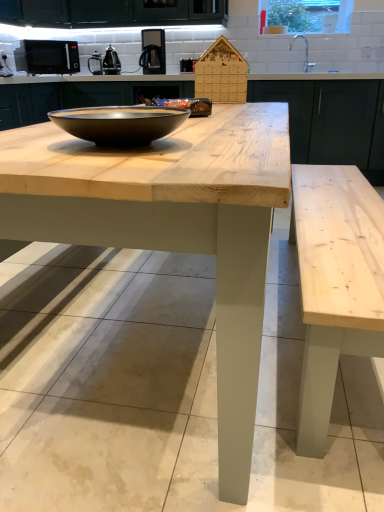
Consider the image. Measure the distance between point (x=114, y=61) and camera.

4.10 meters.

This screenshot has height=512, width=384. What are the coordinates of `natural wood cabinetry at center` in the screenshot? It's located at (331, 120).

Describe the element at coordinates (47, 57) in the screenshot. I see `black matte microwave at upper left, the second appliance in the right-to-left sequence` at that location.

Where is `black matte microwave at upper left, placed as the 1th appliance when sorted from left to right`? black matte microwave at upper left, placed as the 1th appliance when sorted from left to right is located at coordinates (47, 57).

The height and width of the screenshot is (512, 384). What do you see at coordinates (153, 52) in the screenshot? I see `satin black coffee machine at upper center` at bounding box center [153, 52].

I want to click on metallic silver kettle at upper center, placed as the 2th appliance when sorted from left to right, so click(105, 63).

Consider the image. Can you confirm if matte black bowl at center is smaller than natural wood cabinetry at center?

Correct, matte black bowl at center occupies less space than natural wood cabinetry at center.

Does point (124, 117) come farther from viewer compared to point (340, 156)?

No, (124, 117) is in front of (340, 156).

Is matte black bowl at center wider than natural wood cabinetry at center?

No, matte black bowl at center is not wider than natural wood cabinetry at center.

Does matte black bowl at center have a lesser height compared to natural wood cabinetry at center?

Yes, matte black bowl at center is shorter than natural wood cabinetry at center.

Considering the positions of objects black matte microwave at upper left, the second appliance in the right-to-left sequence, and matte black bowl at center in the image provided, who is behind, black matte microwave at upper left, the second appliance in the right-to-left sequence, or matte black bowl at center?

black matte microwave at upper left, the second appliance in the right-to-left sequence, is further from the camera.

Can you confirm if black matte microwave at upper left, placed as the 1th appliance when sorted from left to right, is taller than matte black bowl at center?

Yes, black matte microwave at upper left, placed as the 1th appliance when sorted from left to right, is taller than matte black bowl at center.

Can you tell me how much black matte microwave at upper left, placed as the 1th appliance when sorted from left to right, and matte black bowl at center differ in facing direction?

They differ by 133 degrees in their facing directions.

Considering the relative sizes of satin black coffee machine at upper center and matte black bowl at center in the image provided, is satin black coffee machine at upper center wider than matte black bowl at center?

No, satin black coffee machine at upper center is not wider than matte black bowl at center.

Is point (159, 66) farther from viewer compared to point (169, 106)?

Yes, it is behind point (169, 106).

Is matte black bowl at center a part of satin black coffee machine at upper center?

No.

Is satin black coffee machine at upper center shorter than matte black bowl at center?

In fact, satin black coffee machine at upper center may be taller than matte black bowl at center.

Between black matte microwave at upper left, placed as the 1th appliance when sorted from left to right, and natural wood table at center, which one has smaller width?

black matte microwave at upper left, placed as the 1th appliance when sorted from left to right, is thinner.

Does black matte microwave at upper left, the second appliance in the right-to-left sequence, contain natural wood table at center?

No.

Considering the relative sizes of black matte microwave at upper left, the second appliance in the right-to-left sequence, and natural wood table at center in the image provided, is black matte microwave at upper left, the second appliance in the right-to-left sequence, bigger than natural wood table at center?

Actually, black matte microwave at upper left, the second appliance in the right-to-left sequence, might be smaller than natural wood table at center.

Between black matte microwave at upper left, placed as the 1th appliance when sorted from left to right, and natural wood table at center, which one has more height?

Answer: Standing taller between the two is natural wood table at center.

Considering the sizes of natural wood table at center and matte black bowl at center in the image, is natural wood table at center bigger or smaller than matte black bowl at center?

Considering their sizes, natural wood table at center takes up more space than matte black bowl at center.

Is matte black bowl at center located within natural wood table at center?

That's incorrect, matte black bowl at center is not inside natural wood table at center.

Is point (27, 154) farther from viewer compared to point (169, 124)?

No, (27, 154) is closer to viewer.

Consider the image. Considering the sizes of objects natural wood table at center and matte black bowl at center in the image provided, who is wider, natural wood table at center or matte black bowl at center?

natural wood table at center.

Looking at this image, from the image's perspective, relative to metallic silver kettle at upper center, positioned as the 1th appliance in right-to-left order, is matte black bowl at center above or below?

matte black bowl at center is situated lower than metallic silver kettle at upper center, positioned as the 1th appliance in right-to-left order, in the image.

Can you confirm if matte black bowl at center is bigger than metallic silver kettle at upper center, positioned as the 1th appliance in right-to-left order?

Incorrect, matte black bowl at center is not larger than metallic silver kettle at upper center, positioned as the 1th appliance in right-to-left order.

Can you see matte black bowl at center touching metallic silver kettle at upper center, placed as the 2th appliance when sorted from left to right?

No, matte black bowl at center is not with metallic silver kettle at upper center, placed as the 2th appliance when sorted from left to right.

Can you tell me how much matte black bowl at center and metallic silver kettle at upper center, placed as the 2th appliance when sorted from left to right, differ in facing direction?

The angular difference between matte black bowl at center and metallic silver kettle at upper center, placed as the 2th appliance when sorted from left to right, is 176 degrees.

Can you confirm if natural wood cabinetry at center is bigger than transparent glass window screen at upper right?

Yes.

Is natural wood cabinetry at center taller or shorter than transparent glass window screen at upper right?

Clearly, natural wood cabinetry at center is taller compared to transparent glass window screen at upper right.

Which object is positioned more to the left, natural wood cabinetry at center or transparent glass window screen at upper right?

natural wood cabinetry at center.

From a real-world perspective, relative to transparent glass window screen at upper right, is natural wood cabinetry at center vertically above or below?

natural wood cabinetry at center is below transparent glass window screen at upper right.

The width and height of the screenshot is (384, 512). In order to click on bowl above the natural wood cabinetry at center (from a real-world perspective) in this screenshot , I will do `click(120, 124)`.

Image resolution: width=384 pixels, height=512 pixels. What are the coordinates of `the 2nd appliance above when counting from the matte black bowl at center (from the image's perspective)` in the screenshot? It's located at (47, 57).

Looking at the image, which one is located closer to black matte microwave at upper left, the second appliance in the right-to-left sequence, matte black bowl at center or natural wood cabinetry at center?

natural wood cabinetry at center is closer to black matte microwave at upper left, the second appliance in the right-to-left sequence.

Based on their spatial positions, is satin black coffee machine at upper center or natural wood cabinetry at center closer to transparent glass window screen at upper right?

natural wood cabinetry at center is positioned closer to the anchor transparent glass window screen at upper right.

From the image, which object appears to be farther from metallic silver kettle at upper center, placed as the 2th appliance when sorted from left to right, natural wood table at center or satin black coffee machine at upper center?

natural wood table at center lies further to metallic silver kettle at upper center, placed as the 2th appliance when sorted from left to right, than the other object.

From the image, which object appears to be nearer to black matte microwave at upper left, placed as the 1th appliance when sorted from left to right, matte black bowl at center or satin black coffee machine at upper center?

satin black coffee machine at upper center is closer to black matte microwave at upper left, placed as the 1th appliance when sorted from left to right.

In the scene shown: Based on their spatial positions, is satin black coffee machine at upper center or natural wood table at center closer to transparent glass window screen at upper right?

Based on the image, satin black coffee machine at upper center appears to be nearer to transparent glass window screen at upper right.

From the image, which object appears to be nearer to black matte microwave at upper left, placed as the 1th appliance when sorted from left to right, satin black coffee machine at upper center or metallic silver kettle at upper center, positioned as the 1th appliance in right-to-left order?

metallic silver kettle at upper center, positioned as the 1th appliance in right-to-left order.

Considering their positions, is matte black bowl at center positioned closer to natural wood cabinetry at center than metallic silver kettle at upper center, positioned as the 1th appliance in right-to-left order?

metallic silver kettle at upper center, positioned as the 1th appliance in right-to-left order.

Estimate the real-world distances between objects in this image. Which object is further from transparent glass window screen at upper right, black matte microwave at upper left, placed as the 1th appliance when sorted from left to right, or natural wood cabinetry at center?

black matte microwave at upper left, placed as the 1th appliance when sorted from left to right, is further to transparent glass window screen at upper right.

Locate an element on the screen. Image resolution: width=384 pixels, height=512 pixels. cabinetry positioned between natural wood table at center and metallic silver kettle at upper center, positioned as the 1th appliance in right-to-left order, from near to far is located at coordinates (331, 120).

Locate an element on the screen. cabinetry between natural wood table at center and black matte microwave at upper left, the second appliance in the right-to-left sequence, from front to back is located at coordinates (331, 120).

Where is `bowl positioned between natural wood table at center and black matte microwave at upper left, the second appliance in the right-to-left sequence, from near to far`? bowl positioned between natural wood table at center and black matte microwave at upper left, the second appliance in the right-to-left sequence, from near to far is located at coordinates (120, 124).

You are a GUI agent. You are given a task and a screenshot of the screen. Output one action in this format:
    pyautogui.click(x=<x>, y=<y>)
    Task: Click on the appliance situated between black matte microwave at upper left, placed as the 1th appliance when sorted from left to right, and transparent glass window screen at upper right from left to right
    This screenshot has width=384, height=512.
    Given the screenshot: What is the action you would take?
    pyautogui.click(x=105, y=63)